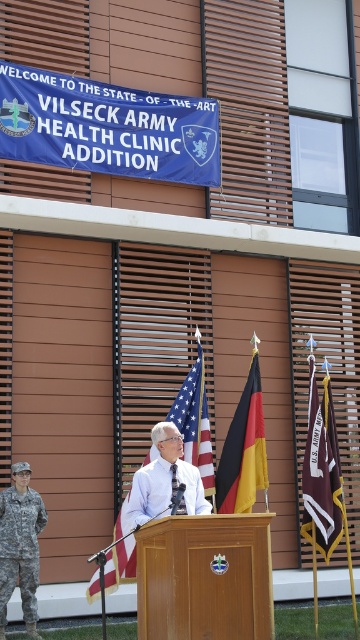
In the scene shown: You are a photographer at the Vilseck Army Health Clinic Addition event. You need to place a small flag between the two points labeled point [186,419] and point [46,518]. Which point should the flag be closer to in order to ensure it is placed closer to the camera?

The flag should be placed closer to point [186,419] because it is further to the camera than point [46,518].

You are standing at the event and want to take a photo of the american flag at center without including the soldier in camouflage uniform to the left of the podium. Is the distance sufficient to frame the photo properly?

The american flag at center is 13.66 meters from viewer, so the distance is sufficient to frame the photo properly without including the soldier in camouflage uniform to the left of the podium.

Looking at this image, you are attending the event and want to take a photo of the american flag at center and the camouflage fabric uniform at left. Which object should you focus on first if you want to capture both in one frame without zooming in or out?

The american flag at center is larger in size than the camouflage fabric uniform at left, so you should focus on the camouflage fabric uniform at left first to ensure both fit in the frame.